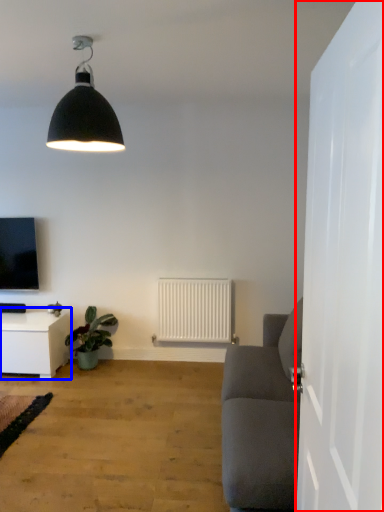
Question: Which object is further to the camera taking this photo, door (highlighted by a red box) or table (highlighted by a blue box)?

Choices:
 (A) door
 (B) table

Answer: (B)